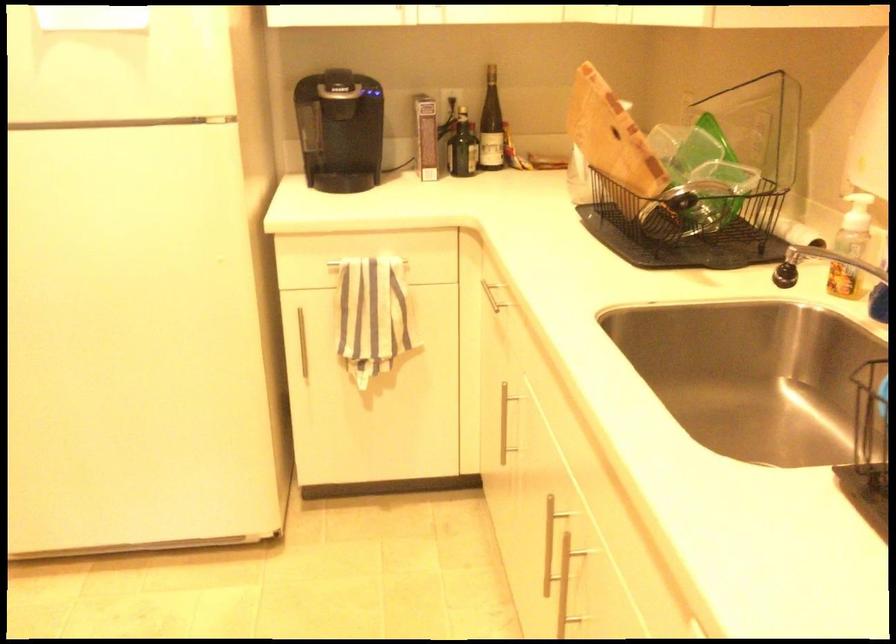
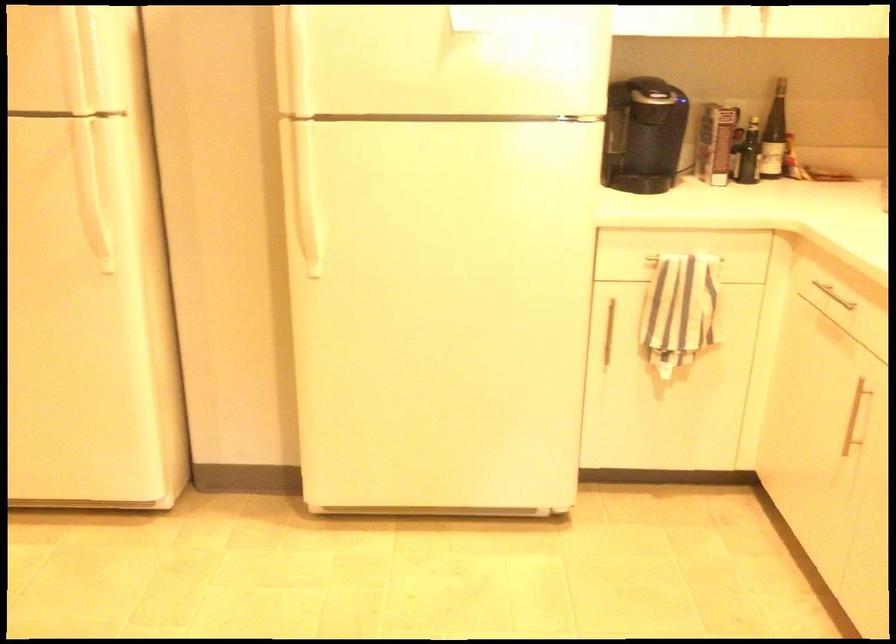
Question: What movement of the cameraman would produce the second image?

Choices:
 (A) Left
 (B) Right
 (C) Forward
 (D) Backward

Answer: (A)